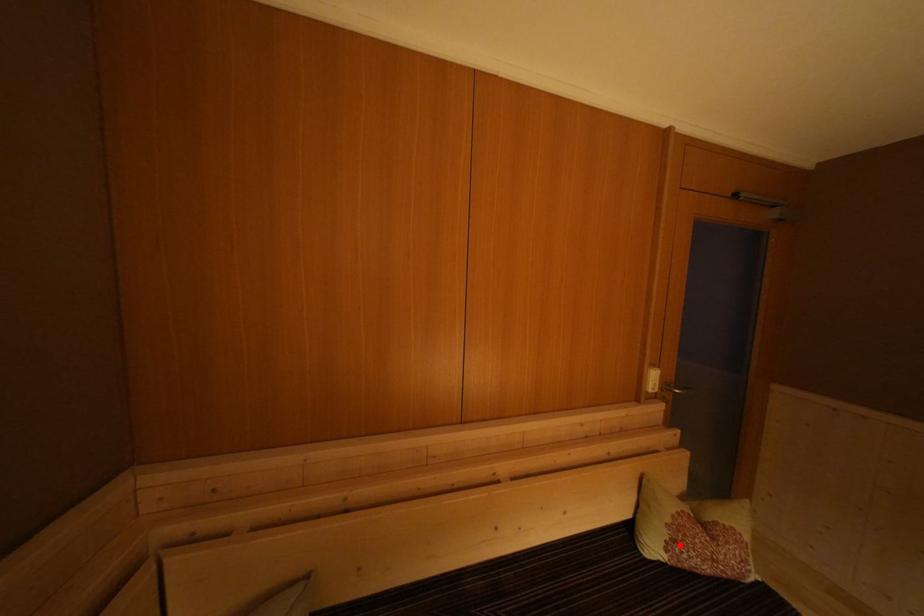
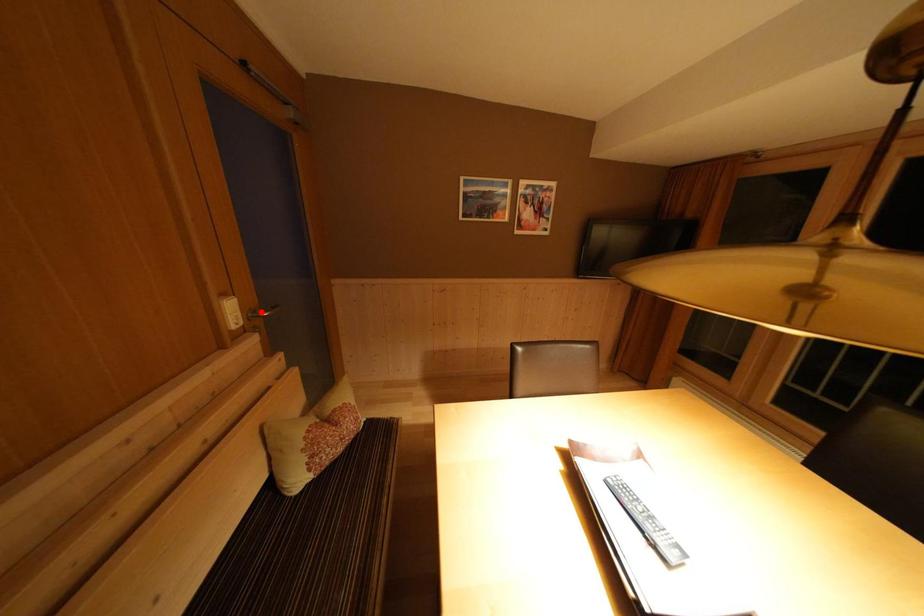
I am providing you with two images of the same scene from different viewpoints. A red point is marked on the first image and another point is marked on the second image. Is the red point in image1 aligned with the point shown in image2?

No